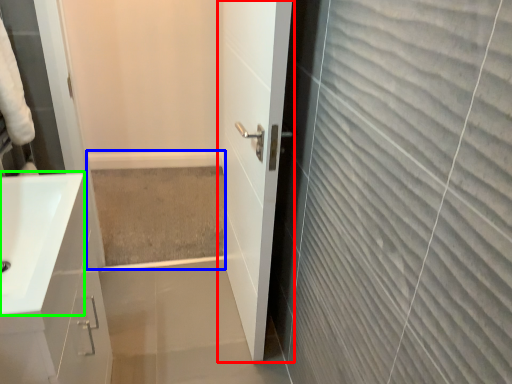
Question: Which object is positioned farthest from door (highlighted by a red box)? Select from bath (highlighted by a blue box) and sink (highlighted by a green box).

Choices:
 (A) bath
 (B) sink

Answer: (A)